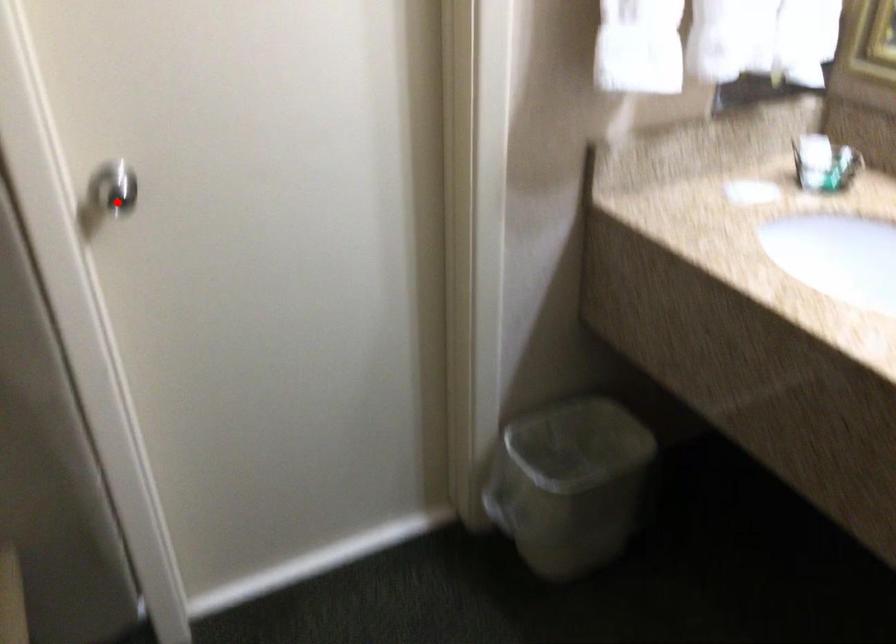
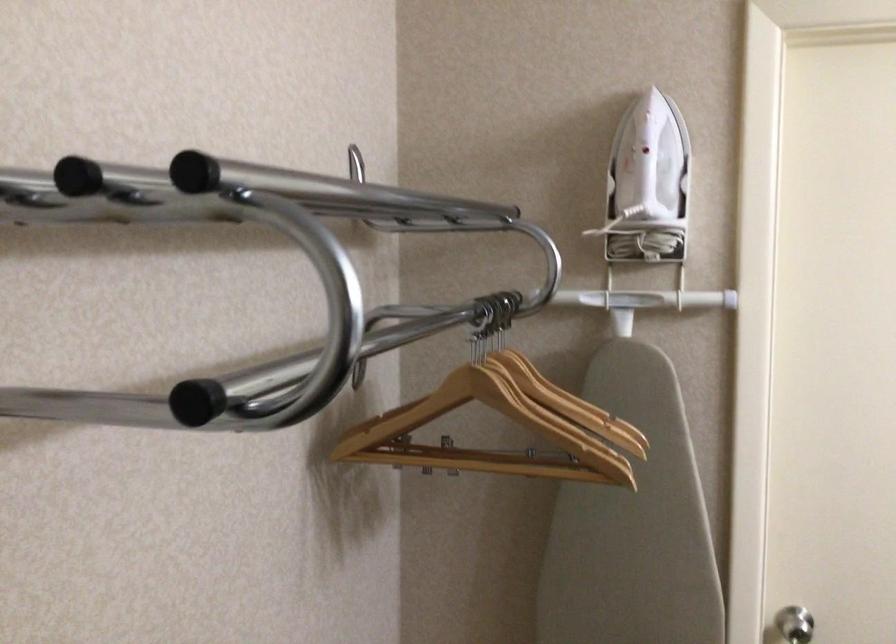
Find the pixel in the second image that matches the highlighted location in the first image.

(794, 625)